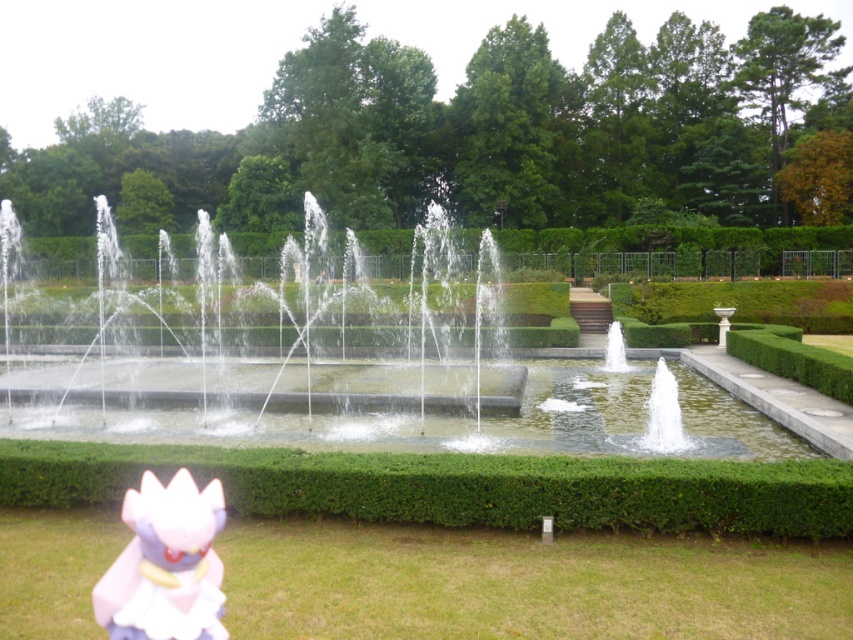
What do you see at coordinates (166, 563) in the screenshot? I see `pink matte plush at lower left` at bounding box center [166, 563].

Does pink matte plush at lower left have a lesser width compared to clear glass water at center?

Indeed, pink matte plush at lower left has a lesser width compared to clear glass water at center.

Who is more distant from viewer, (155,577) or (605,355)?

Point (605,355)

I want to click on pink matte plush at lower left, so click(x=166, y=563).